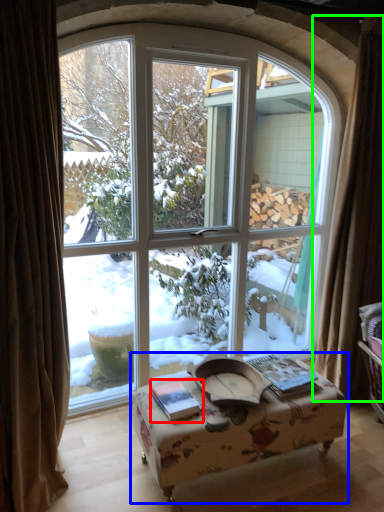
Question: Considering the real-world distances, which object is farthest from book (highlighted by a red box)? table (highlighted by a blue box) or curtain (highlighted by a green box)?

Choices:
 (A) table
 (B) curtain

Answer: (B)